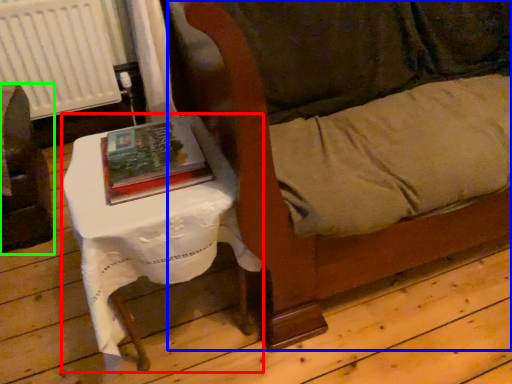
Question: Based on their relative distances, which object is farther from table (highlighted by a red box)? Choose from couch (highlighted by a blue box) and furniture (highlighted by a green box).

Choices:
 (A) couch
 (B) furniture

Answer: (B)